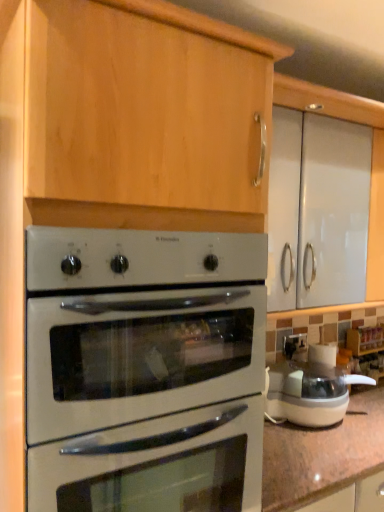
Question: From the image's perspective, is white glossy oven at center located above or below white plastic food processor at right?

Choices:
 (A) above
 (B) below

Answer: (A)

Question: Considering their positions, is white glossy oven at center located in front of or behind white plastic food processor at right?

Choices:
 (A) behind
 (B) front

Answer: (B)

Question: In the image, is white glossy oven at center on the left side or the right side of white plastic food processor at right?

Choices:
 (A) right
 (B) left

Answer: (B)

Question: Do you think white plastic food processor at right is within white glossy oven at center, or outside of it?

Choices:
 (A) inside
 (B) outside

Answer: (B)

Question: From a real-world perspective, is white plastic food processor at right positioned above or below white glossy oven at center?

Choices:
 (A) below
 (B) above

Answer: (A)

Question: In the image, is white plastic food processor at right positioned in front of or behind white glossy oven at center?

Choices:
 (A) front
 (B) behind

Answer: (B)

Question: In terms of height, does white plastic food processor at right look taller or shorter compared to white glossy oven at center?

Choices:
 (A) tall
 (B) short

Answer: (B)